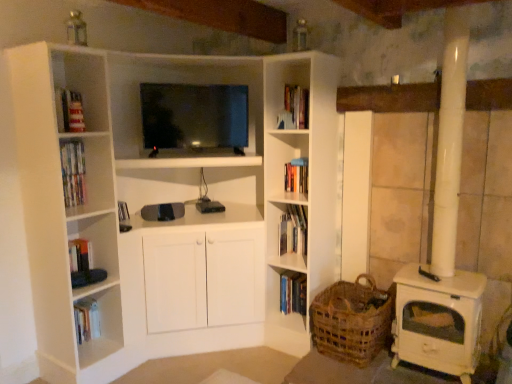
Question: Is woven brown basket at lower right oriented away from hardcover book at center, which is counted as the 2th book, starting from the bottom?

Choices:
 (A) no
 (B) yes

Answer: (A)

Question: Is woven brown basket at lower right surrounding hardcover book at center, arranged as the first book when viewed from the top?

Choices:
 (A) yes
 (B) no

Answer: (B)

Question: From a real-world perspective, is woven brown basket at lower right under hardcover book at center, which is counted as the 2th book, starting from the bottom?

Choices:
 (A) yes
 (B) no

Answer: (A)

Question: Does woven brown basket at lower right appear on the right side of hardcover book at center, arranged as the first book when viewed from the top?

Choices:
 (A) yes
 (B) no

Answer: (A)

Question: From a real-world perspective, is woven brown basket at lower right physically above hardcover book at center, arranged as the first book when viewed from the top?

Choices:
 (A) yes
 (B) no

Answer: (B)

Question: Does woven brown basket at lower right turn towards hardcover book at center, arranged as the first book when viewed from the top?

Choices:
 (A) yes
 (B) no

Answer: (B)

Question: Is hardcover book at center, the 2th book in the top-to-bottom sequence, not near matte black tv at center?

Choices:
 (A) no
 (B) yes

Answer: (B)

Question: Can you confirm if hardcover book at center, the 2th book in the top-to-bottom sequence, is wider than matte black tv at center?

Choices:
 (A) yes
 (B) no

Answer: (B)

Question: Is hardcover book at center, the 2th book in the top-to-bottom sequence, facing away from matte black tv at center?

Choices:
 (A) yes
 (B) no

Answer: (B)

Question: Is hardcover book at center, the 2th book in the top-to-bottom sequence, taller than matte black tv at center?

Choices:
 (A) yes
 (B) no

Answer: (B)

Question: From the image's perspective, is hardcover book at center, the 2th book in the top-to-bottom sequence, beneath matte black tv at center?

Choices:
 (A) yes
 (B) no

Answer: (A)

Question: Is hardcover book at center, which is the first book in bottom-to-top order, outside matte black tv at center?

Choices:
 (A) no
 (B) yes

Answer: (B)

Question: Does matte black tv at center have a greater height compared to hardcover book at center, which is counted as the 2th book, starting from the bottom?

Choices:
 (A) no
 (B) yes

Answer: (B)